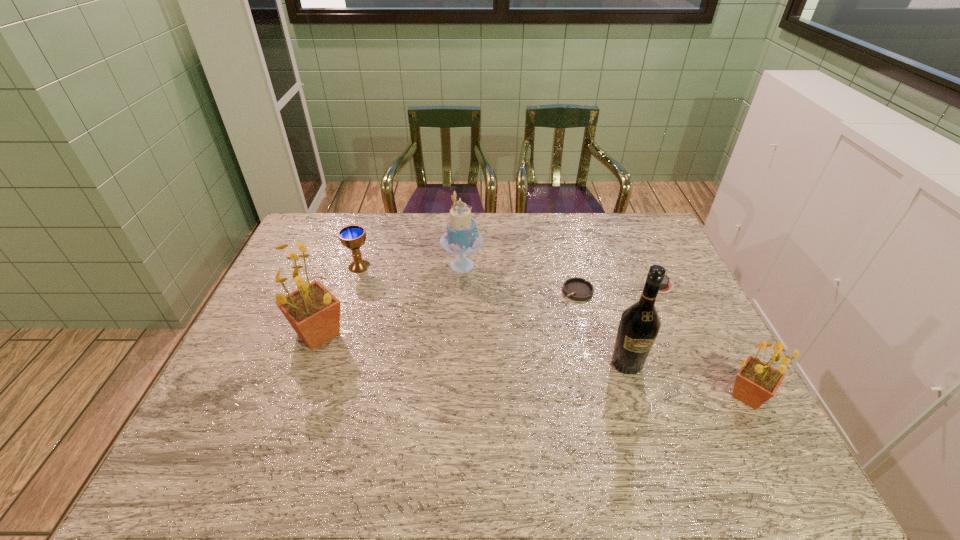
At what (x,y) coordinates should I click in order to perform the action: click on vacant spot for a new sunflower to ensure equal spacing. Please return your answer as a coordinate pair (x, y). Looking at the image, I should click on (519, 363).